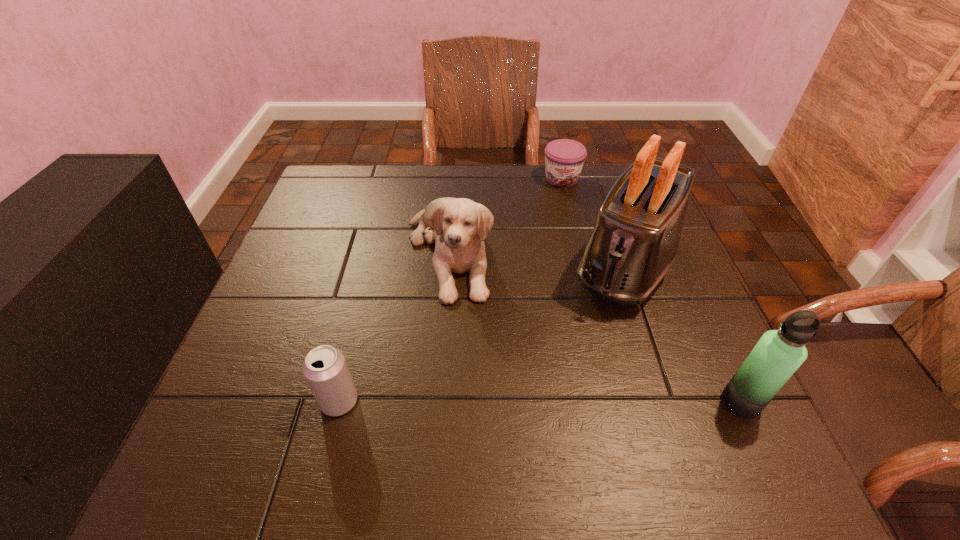
Image resolution: width=960 pixels, height=540 pixels. I want to click on vacant space located 0.050m on the side of the toaster with the control lever, so click(597, 322).

The height and width of the screenshot is (540, 960). What are the coordinates of `vacant space situated 0.280m on the side of the toaster with the control lever` in the screenshot? It's located at (547, 407).

The height and width of the screenshot is (540, 960). Identify the location of free space located 0.070m on the side of the toaster with the control lever. (593, 329).

Identify the location of vacant space located on the front label of the jam. (570, 240).

Locate an element on the screen. free region located 0.230m on the front label of the jam is located at coordinates (571, 242).

Identify the location of free space located 0.340m on the front label of the jam. (575, 273).

I want to click on free spot located on the front-facing side of the puppy, so click(512, 421).

Locate an element on the screen. Image resolution: width=960 pixels, height=540 pixels. vacant space located on the front-facing side of the puppy is located at coordinates (512, 421).

The image size is (960, 540). I want to click on free region located 0.090m on the front-facing side of the puppy, so click(x=474, y=334).

Where is `jam located in the far edge section of the desktop`? This screenshot has width=960, height=540. jam located in the far edge section of the desktop is located at coordinates (564, 158).